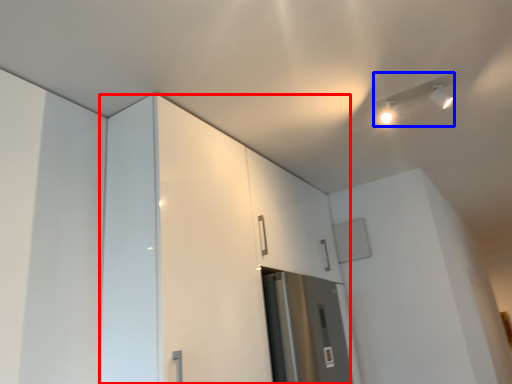
Question: Which object appears farthest to the camera in this image, dresser (highlighted by a red box) or light fixture (highlighted by a blue box)?

Choices:
 (A) dresser
 (B) light fixture

Answer: (B)